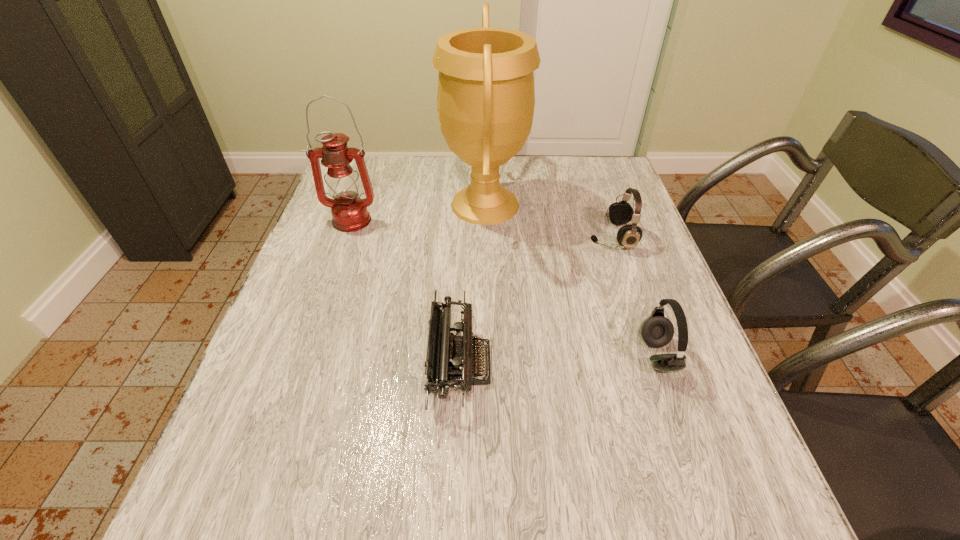
Identify the location of vacant space situated 0.150m with the microphone on the side of the farther headset. The height and width of the screenshot is (540, 960). (534, 238).

Locate an element on the screen. The height and width of the screenshot is (540, 960). vacant region located with the microphone on the side of the farther headset is located at coordinates (508, 238).

Where is `vacant region located 0.070m with the microphone on the side of the farther headset`? The width and height of the screenshot is (960, 540). vacant region located 0.070m with the microphone on the side of the farther headset is located at coordinates (564, 238).

I want to click on vacant space located 0.310m on the ear cups of the nearer headset, so click(x=492, y=355).

Image resolution: width=960 pixels, height=540 pixels. Identify the location of free space located on the ear cups of the nearer headset. (617, 355).

Locate an element on the screen. vacant space positioned 0.130m on the ear cups of the nearer headset is located at coordinates (579, 355).

Find the location of a particular element. The height and width of the screenshot is (540, 960). vacant space located on the typing side of the shortest object is located at coordinates (549, 364).

At what (x,y) coordinates should I click in order to perform the action: click on object that is at the far edge. Please return your answer as a coordinate pair (x, y). This screenshot has width=960, height=540. Looking at the image, I should click on (486, 97).

Find the location of a particular element. object that is at the left edge is located at coordinates (349, 212).

In the image, there is a desktop. In order to click on blank space at the far edge in this screenshot , I will do `click(401, 180)`.